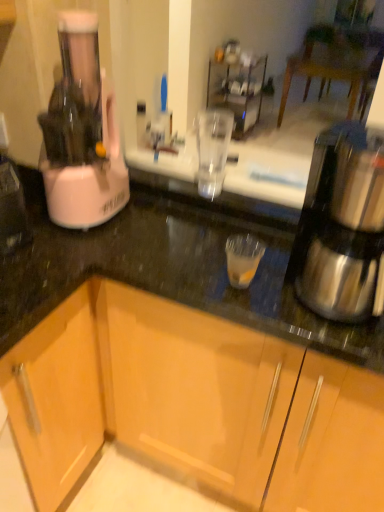
Question: Which direction should I rotate to look at wooden cabinet at lower center, acting as the 1th cabinetry starting from the right?

Choices:
 (A) left
 (B) right

Answer: (A)

Question: Is shiny metallic coffee maker at right behind white plastic blender at left?

Choices:
 (A) yes
 (B) no

Answer: (B)

Question: Is shiny metallic coffee maker at right looking in the opposite direction of white plastic blender at left?

Choices:
 (A) yes
 (B) no

Answer: (B)

Question: Is shiny metallic coffee maker at right to the right of white plastic blender at left from the viewer's perspective?

Choices:
 (A) yes
 (B) no

Answer: (A)

Question: Is shiny metallic coffee maker at right to the left of white plastic blender at left from the viewer's perspective?

Choices:
 (A) no
 (B) yes

Answer: (A)

Question: Considering the relative sizes of shiny metallic coffee maker at right and white plastic blender at left in the image provided, is shiny metallic coffee maker at right taller than white plastic blender at left?

Choices:
 (A) yes
 (B) no

Answer: (B)

Question: From a real-world perspective, does shiny metallic coffee maker at right sit lower than white plastic blender at left?

Choices:
 (A) no
 (B) yes

Answer: (B)

Question: Can you confirm if white plastic blender at left is thinner than wooden cabinet at lower left, the first cabinetry in the left-to-right sequence?

Choices:
 (A) yes
 (B) no

Answer: (A)

Question: Is white plastic blender at left positioned before wooden cabinet at lower left, which is the 2th cabinetry in right-to-left order?

Choices:
 (A) yes
 (B) no

Answer: (A)

Question: Can you confirm if white plastic blender at left is shorter than wooden cabinet at lower left, which is the 2th cabinetry in right-to-left order?

Choices:
 (A) no
 (B) yes

Answer: (B)

Question: Is white plastic blender at left smaller than wooden cabinet at lower left, the first cabinetry in the left-to-right sequence?

Choices:
 (A) yes
 (B) no

Answer: (A)

Question: From a real-world perspective, is white plastic blender at left positioned over wooden cabinet at lower left, the first cabinetry in the left-to-right sequence, based on gravity?

Choices:
 (A) yes
 (B) no

Answer: (A)

Question: Is white plastic blender at left oriented away from wooden cabinet at lower left, which is the 2th cabinetry in right-to-left order?

Choices:
 (A) no
 (B) yes

Answer: (A)

Question: Does wooden cabinet at lower center, acting as the 1th cabinetry starting from the right, have a lesser width compared to shiny metallic coffee maker at right?

Choices:
 (A) no
 (B) yes

Answer: (A)